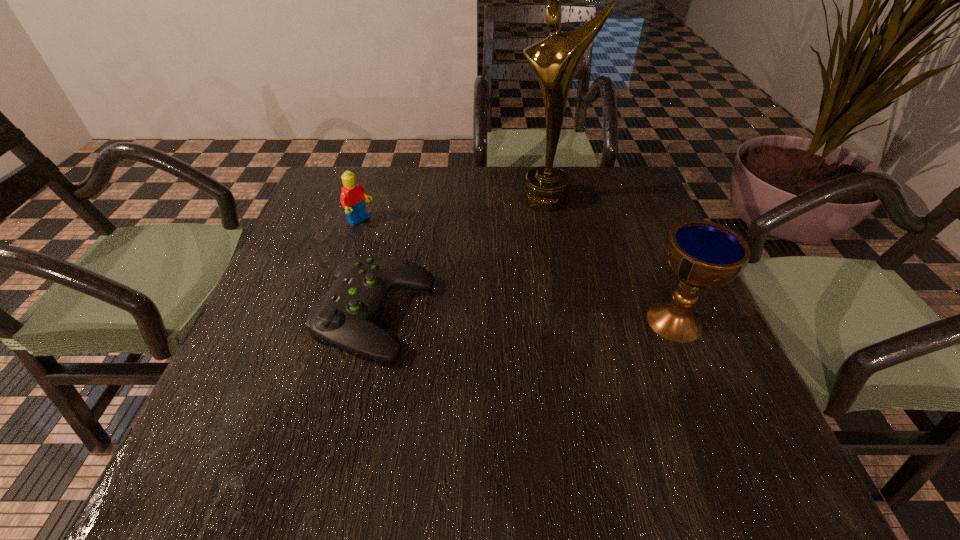
I want to click on vacant space on the desktop that is between the control and the chalice and is positioned on the face of the Lego, so click(x=519, y=318).

This screenshot has width=960, height=540. I want to click on free space on the desktop that is between the shortest object and the chalice and is positioned on the front-facing side of the third object from left to right, so click(497, 318).